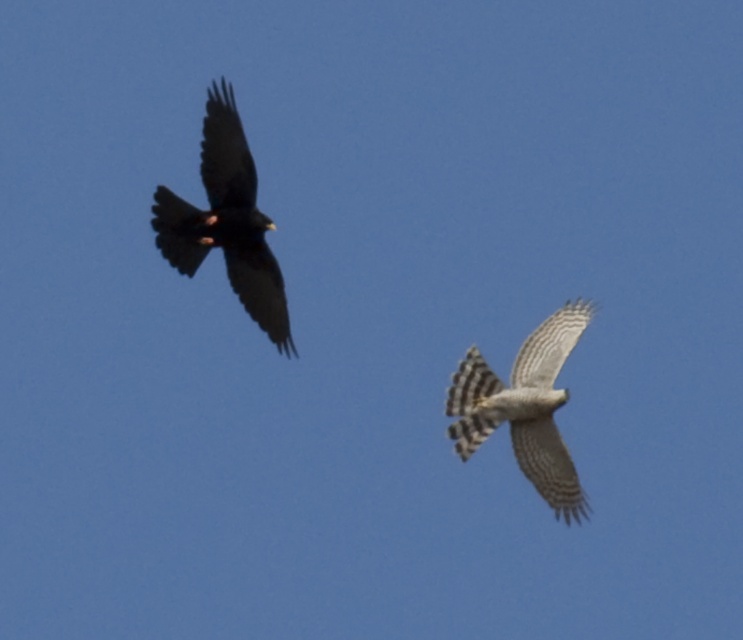
Question: Does dark brown feathers at left have a larger size compared to gray striped feathers at center?

Choices:
 (A) no
 (B) yes

Answer: (A)

Question: Which point is closer to the camera taking this photo?

Choices:
 (A) (528, 374)
 (B) (259, 241)

Answer: (B)

Question: Which object appears closest to the camera in this image?

Choices:
 (A) dark brown feathers at left
 (B) gray striped feathers at center

Answer: (A)

Question: Does dark brown feathers at left appear over gray striped feathers at center?

Choices:
 (A) no
 (B) yes

Answer: (B)

Question: Which point is closer to the camera taking this photo?

Choices:
 (A) (247, 244)
 (B) (557, 358)

Answer: (A)

Question: Can you confirm if dark brown feathers at left is bigger than gray striped feathers at center?

Choices:
 (A) yes
 (B) no

Answer: (B)